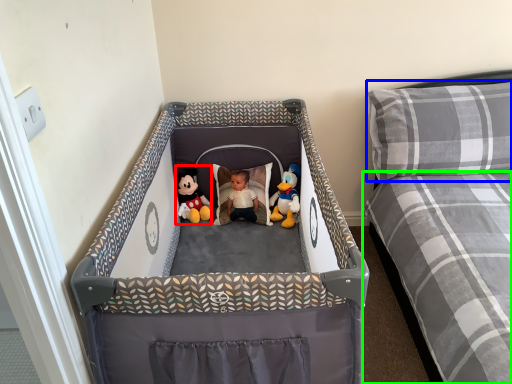
Question: Based on their relative distances, which object is nearer to toy (highlighted by a red box)? Choose from pillow (highlighted by a blue box) and mattress (highlighted by a green box).

Choices:
 (A) pillow
 (B) mattress

Answer: (A)